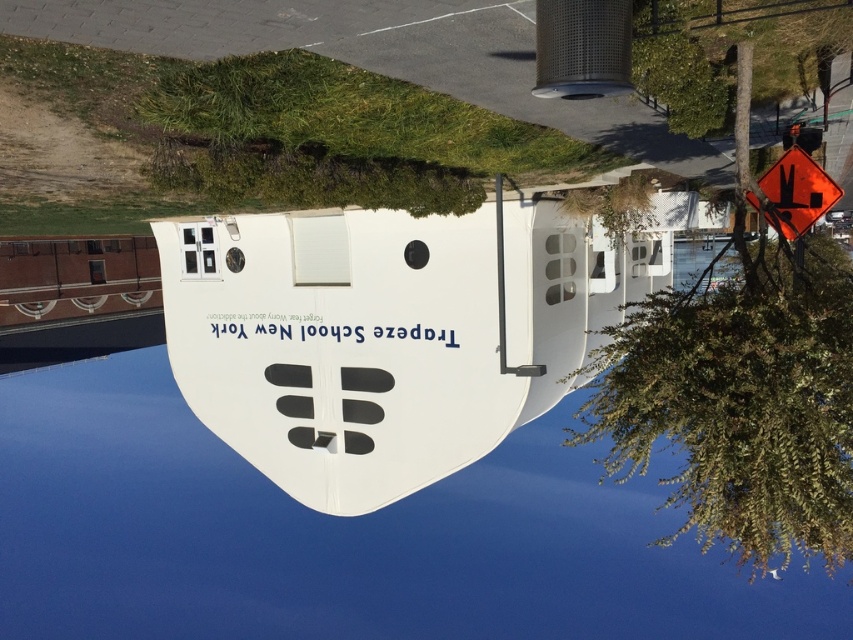
You are an architect analyzing the layout of this space. You need to determine which object, the blue glossy water at center or the orange reflective diamond at upper right, has a greater width for potential placement of a new structure. Based on the scene, which one is wider?

The blue glossy water at center is wider than the orange reflective diamond at upper right, so the blue glossy water at center would be the better option for placement due to its greater width.

You are standing in front of the Trapeze School New York building and notice the blue glossy water at center. Can you determine its exact location using coordinates?

The blue glossy water at center is located at coordinates point (339,531).

You are standing on the dock and want to board the white matte boat at center. Is the blue glossy water at center between you and the boat?

Yes, the blue glossy water at center is between you and the white matte boat at center because the blue glossy water at center is closer to the viewer than the white matte boat at center.